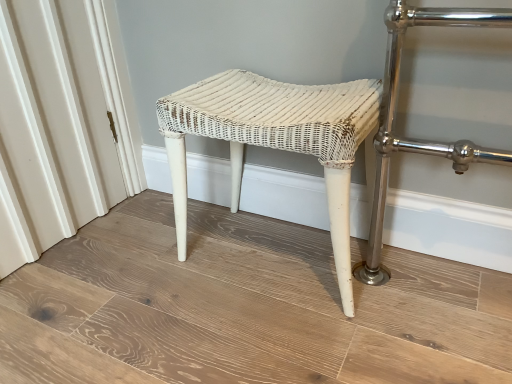
Question: From the image's perspective, does white wicker stool at center appear lower than white wicker stool at center?

Choices:
 (A) yes
 (B) no

Answer: (B)

Question: Does white wicker stool at center lie in front of white wicker stool at center?

Choices:
 (A) no
 (B) yes

Answer: (A)

Question: Is white wicker stool at center at the left side of white wicker stool at center?

Choices:
 (A) yes
 (B) no

Answer: (B)

Question: Considering the relative sizes of white wicker stool at center and white wicker stool at center in the image provided, is white wicker stool at center thinner than white wicker stool at center?

Choices:
 (A) no
 (B) yes

Answer: (B)

Question: Is white wicker stool at center at the right side of white wicker stool at center?

Choices:
 (A) yes
 (B) no

Answer: (A)

Question: From a real-world perspective, is white wicker stool at center on top of white wicker stool at center?

Choices:
 (A) no
 (B) yes

Answer: (B)

Question: Can you confirm if white wicker stool at center is wider than white wicker stool at center?

Choices:
 (A) yes
 (B) no

Answer: (A)

Question: Is the position of white wicker stool at center less distant than that of white wicker stool at center?

Choices:
 (A) yes
 (B) no

Answer: (A)

Question: Does white wicker stool at center turn towards white wicker stool at center?

Choices:
 (A) no
 (B) yes

Answer: (B)

Question: Is white wicker stool at center oriented away from white wicker stool at center?

Choices:
 (A) yes
 (B) no

Answer: (A)

Question: Is white wicker stool at center thinner than white wicker stool at center?

Choices:
 (A) no
 (B) yes

Answer: (A)

Question: Is white wicker stool at center next to white wicker stool at center and touching it?

Choices:
 (A) no
 (B) yes

Answer: (A)

Question: Is white wicker stool at center in front of or behind white wicker stool at center in the image?

Choices:
 (A) behind
 (B) front

Answer: (B)